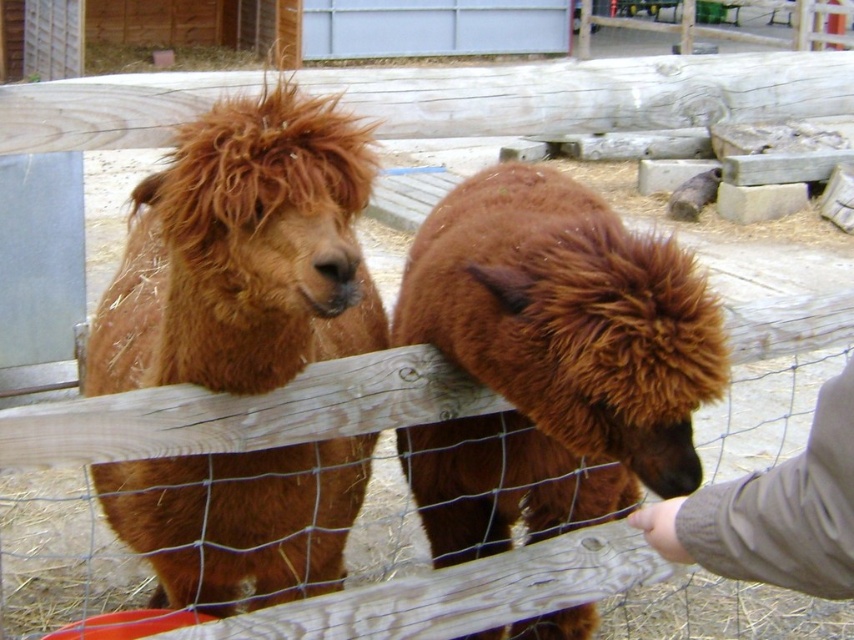
You are standing at the point marked by coordinates point (243, 252) in the image. Based on the scene, what animal are you facing?

The point (243, 252) marks the location of the brown fluffy alpaca at left, so you are facing the brown fluffy alpaca at left.

You are standing at the origin point of the coordinate system in the image. The brown fluffy alpaca at left is located at point 0.395, 0.286. If you want to walk directly towards it, which direction should you move in?

To reach the brown fluffy alpaca at left located at coordinates (243, 252) from the origin, you should move northeast since the x and y coordinates are both positive.

You are a photographer trying to capture both the brown fluffy alpaca at left and the brown fluffy camel at center in a single shot. Since you want to ensure both are in focus, which one should you focus on first to maximize the chances of both being sharp?

You should focus on the brown fluffy camel at center first because it is farther away from the viewer than the brown fluffy alpaca at left, so focusing on the farther subject will help keep both in focus.